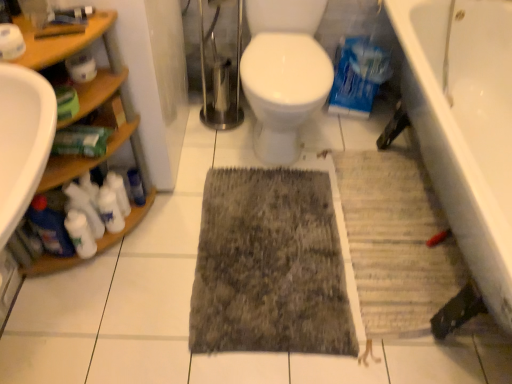
Where is `free area in between white matte cleaning product at lower left, the 3th cleaning product viewed from the right, and gray textured bath mat at lower right`? This screenshot has height=384, width=512. free area in between white matte cleaning product at lower left, the 3th cleaning product viewed from the right, and gray textured bath mat at lower right is located at coordinates (258, 243).